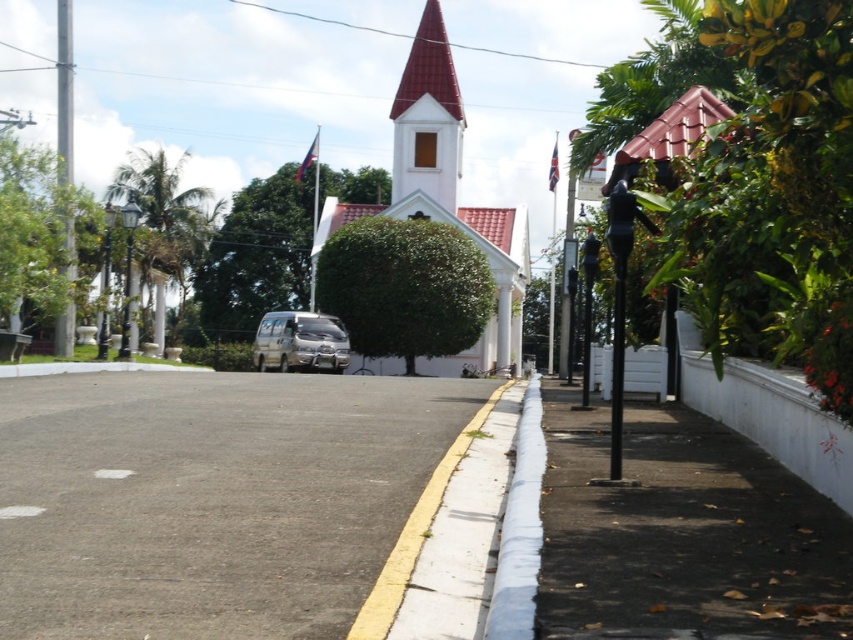
You are a delivery driver who needs to park your truck, which is 10 meters long, near the white matte church at center. The white painted concrete curb at lower center is in the way. Can you park your truck without hitting the curb?

The white matte church at center is larger in size than the white painted concrete curb at lower center. However, the size comparison does not provide information about the distance between them. Without knowing the distance between the church and the curb, it is impossible to determine if the truck can park without hitting the curb.

You are a pedestrian standing on the sidewalk in front of the white building with a red roof. You see the white painted concrete curb at lower center and the silver metallic van at center. Which object is closer to your feet?

The white painted concrete curb at lower center is closer to your feet because it is positioned below the silver metallic van at center, indicating it is nearer in the scene.